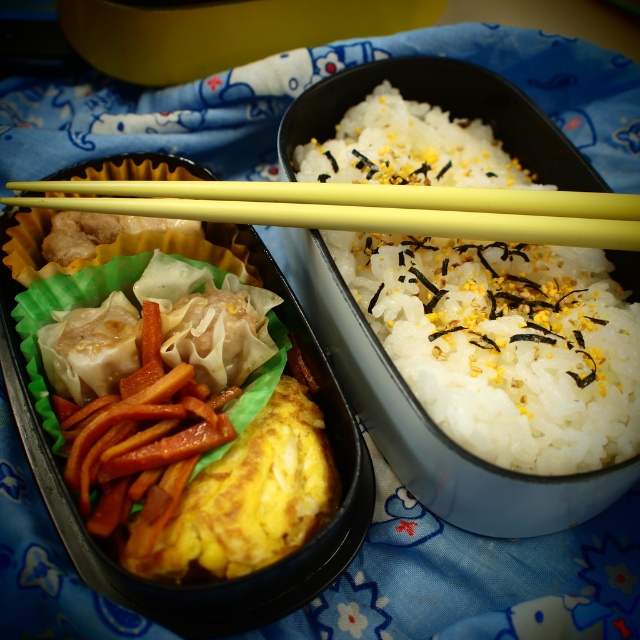
Can you confirm if white rice at center is bigger than yellow plastic chopsticks at center?

Indeed, white rice at center has a larger size compared to yellow plastic chopsticks at center.

Looking at this image, which of these two, white rice at center or yellow plastic chopsticks at center, stands taller?

white rice at center is taller.

Between point (380, 284) and point (400, 216), which one is positioned behind?

The point (380, 284) is behind.

This screenshot has height=640, width=640. I want to click on white rice at center, so click(x=506, y=342).

Is the position of yellow soft omelette at center more distant than that of yellow plastic chopsticks at center?

No, it is in front of yellow plastic chopsticks at center.

Is point (77, 481) positioned before point (611, 212)?

Yes, it is.

Between point (156, 275) and point (621, 209), which one is positioned behind?

The point (156, 275) is more distant.

You are a GUI agent. You are given a task and a screenshot of the screen. Output one action in this format:
    pyautogui.click(x=<x>, y=<y>)
    Task: Click on the yellow soft omelette at center
    
    Given the screenshot: What is the action you would take?
    pyautogui.click(x=188, y=424)

Is white rice at center taller than yellow soft omelette at center?

Indeed, white rice at center has a greater height compared to yellow soft omelette at center.

Which is behind, point (358, 112) or point (173, 444)?

The point (358, 112) is behind.

At what (x,y) coordinates should I click in order to perform the action: click on white rice at center. Please return your answer as a coordinate pair (x, y). This screenshot has height=640, width=640. Looking at the image, I should click on (506, 342).